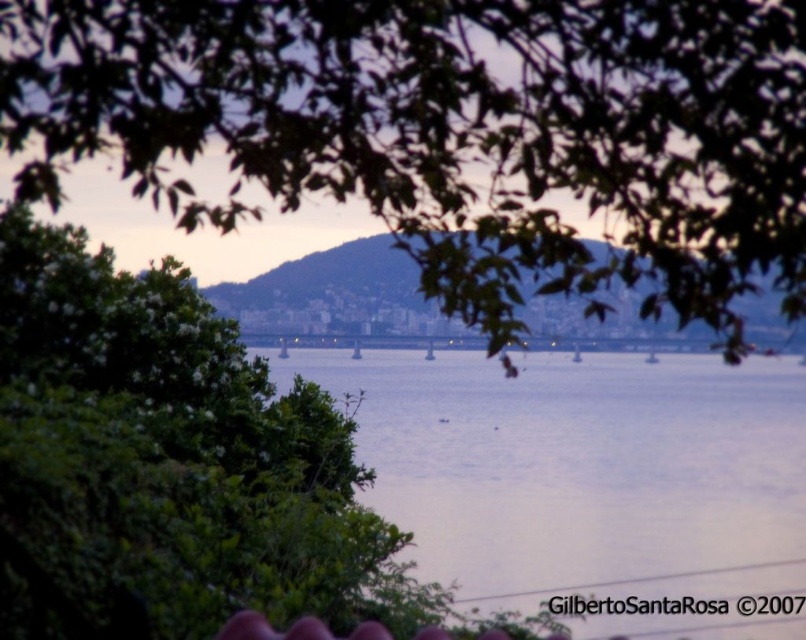
Is blue water at center positioned behind white plastic boat at center?

No, it is not.

Which is more to the right, blue water at center or white plastic boat at center?

white plastic boat at center

Identify the location of blue water at center. pos(588,477).

Is point (578, 352) farther from viewer compared to point (651, 362)?

That is True.

Measure the distance between point (576,353) and camera.

9.75 meters

Find the location of `white plastic boat at center`. white plastic boat at center is located at coordinates (x=576, y=355).

Can you confirm if green leafy tree at upper center is positioned below white plastic boat at center?

Incorrect, green leafy tree at upper center is not positioned below white plastic boat at center.

Does point (802, 237) come closer to viewer compared to point (580, 349)?

Yes, point (802, 237) is in front of point (580, 349).

Is point (758, 54) positioned after point (575, 348)?

No, (758, 54) is in front of (575, 348).

Identify the location of green leafy tree at upper center. (451, 131).